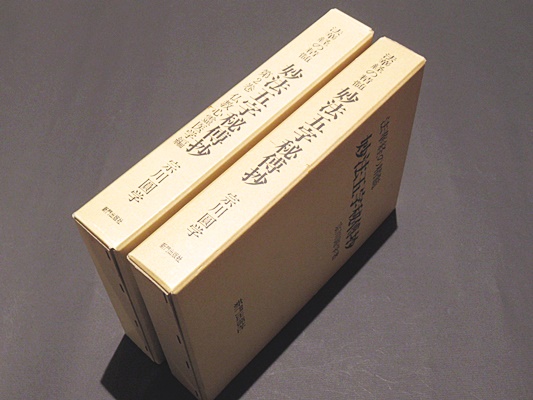
The image size is (533, 400). Find the location of `book`. book is located at coordinates (254, 101), (281, 160).